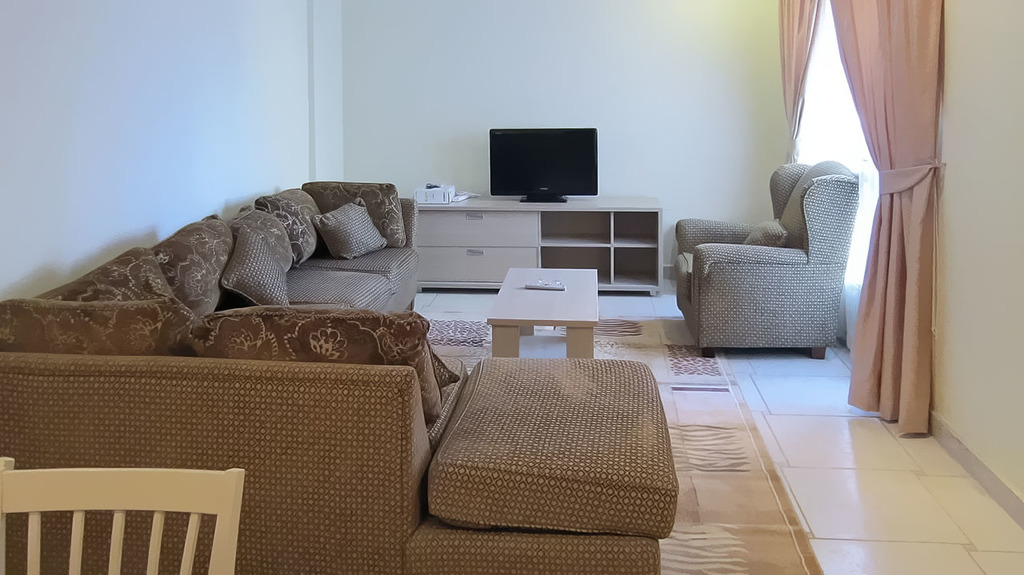
What are the coordinates of `couch` in the screenshot? It's located at (341, 444).